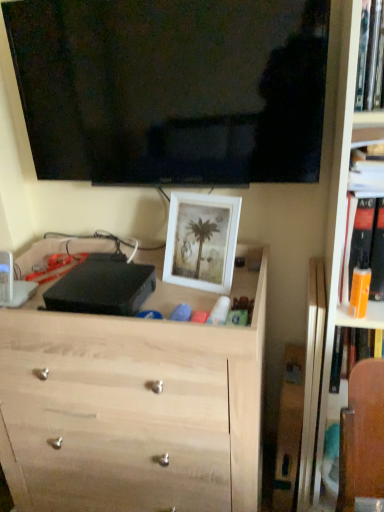
Question: Is orange plastic bottle at right, which ranks as the third book in top-to-bottom order, aimed at black glossy tv at upper center?

Choices:
 (A) no
 (B) yes

Answer: (A)

Question: Is orange plastic bottle at right, the first book from the bottom, smaller than black glossy tv at upper center?

Choices:
 (A) no
 (B) yes

Answer: (B)

Question: Considering the relative sizes of orange plastic bottle at right, the first book from the bottom, and black glossy tv at upper center in the image provided, is orange plastic bottle at right, the first book from the bottom, bigger than black glossy tv at upper center?

Choices:
 (A) yes
 (B) no

Answer: (B)

Question: Can you confirm if orange plastic bottle at right, the first book from the bottom, is wider than black glossy tv at upper center?

Choices:
 (A) yes
 (B) no

Answer: (A)

Question: Is orange plastic bottle at right, which ranks as the third book in top-to-bottom order, positioned in front of black glossy tv at upper center?

Choices:
 (A) no
 (B) yes

Answer: (A)

Question: Is the surface of orange plastic bottle at right, the first book from the bottom, in direct contact with black glossy tv at upper center?

Choices:
 (A) no
 (B) yes

Answer: (A)

Question: Could you tell me if white matte picture frame at center is facing hardcover book at upper right, the first book positioned from the top?

Choices:
 (A) yes
 (B) no

Answer: (B)

Question: Can you confirm if white matte picture frame at center is positioned to the left of hardcover book at upper right, the first book positioned from the top?

Choices:
 (A) yes
 (B) no

Answer: (A)

Question: Considering the relative sizes of white matte picture frame at center and hardcover book at upper right, the third book when ordered from bottom to top, in the image provided, is white matte picture frame at center shorter than hardcover book at upper right, the third book when ordered from bottom to top,?

Choices:
 (A) yes
 (B) no

Answer: (A)

Question: Is white matte picture frame at center wider than hardcover book at upper right, the first book positioned from the top?

Choices:
 (A) no
 (B) yes

Answer: (A)

Question: Does white matte picture frame at center come in front of hardcover book at upper right, the third book when ordered from bottom to top?

Choices:
 (A) no
 (B) yes

Answer: (A)

Question: Is white matte picture frame at center bigger than hardcover book at upper right, the first book positioned from the top?

Choices:
 (A) no
 (B) yes

Answer: (B)

Question: Would you consider hardcover book at upper right, which is counted as the second book, starting from the bottom, to be distant from white matte picture frame at center?

Choices:
 (A) no
 (B) yes

Answer: (A)